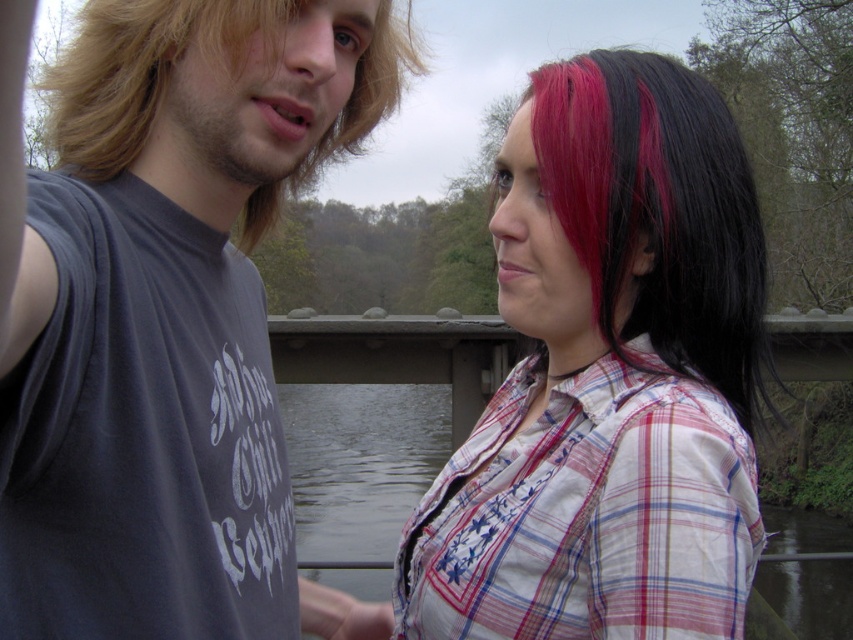
You are a photographer trying to capture the plaid shirt at center in the image. The camera you are using has a rectangular viewfinder with a fixed aspect ratio of 4x6. The point at coordinates (608, 378) is marked as the center of the plaid shirt. If you want to ensure the plaid shirt at center is fully within the viewfinder, what is the minimum distance in pixels between the edges of the viewfinder and the plaid shirt at center?

The point at (608, 378) marks the center of the plaid shirt at center. To ensure it is fully within the 4x6 viewfinder, the minimum distance required would depend on the shirt size and its position relative to the edges. However, since the exact dimensions aren

You are a photographer trying to capture a group photo of the two people in the scene. Given that the plaid shirt at center and the plaid cotton shirt at right are part of the composition, which one should you position closer to the front to ensure both are visible in the frame?

The plaid cotton shirt at right should be positioned closer to the front since it is shorter than the plaid shirt at center, allowing both to be visible in the frame.